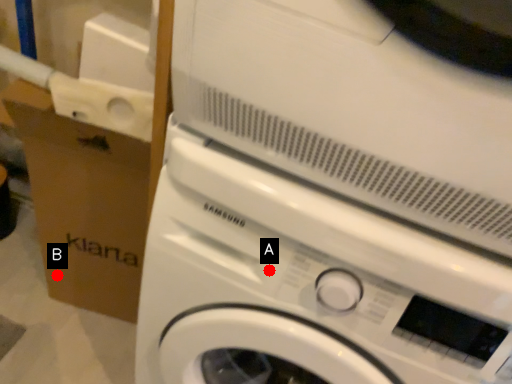
Question: Two points are circled on the image, labeled by A and B beside each circle. Which point is further to the camera?

Choices:
 (A) A is further
 (B) B is further

Answer: (B)